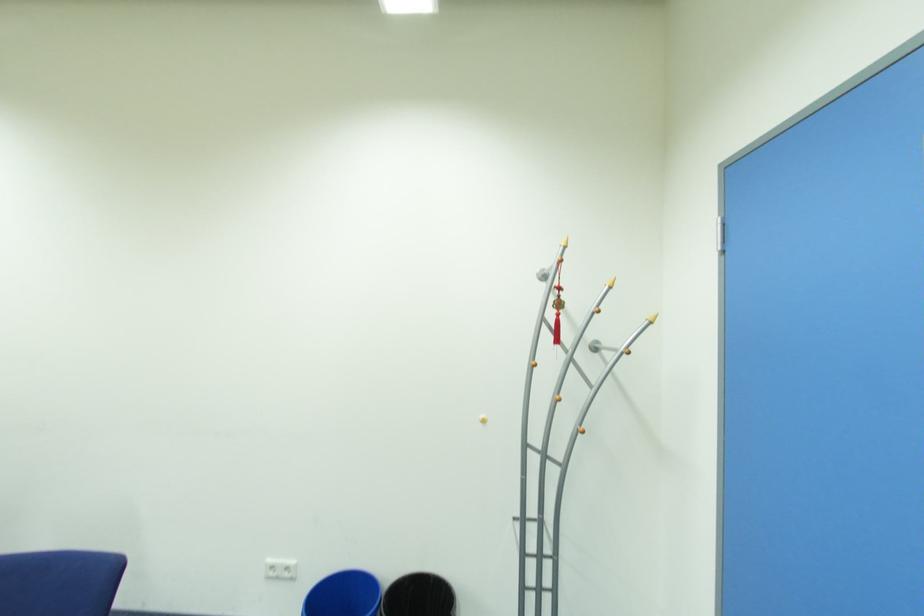
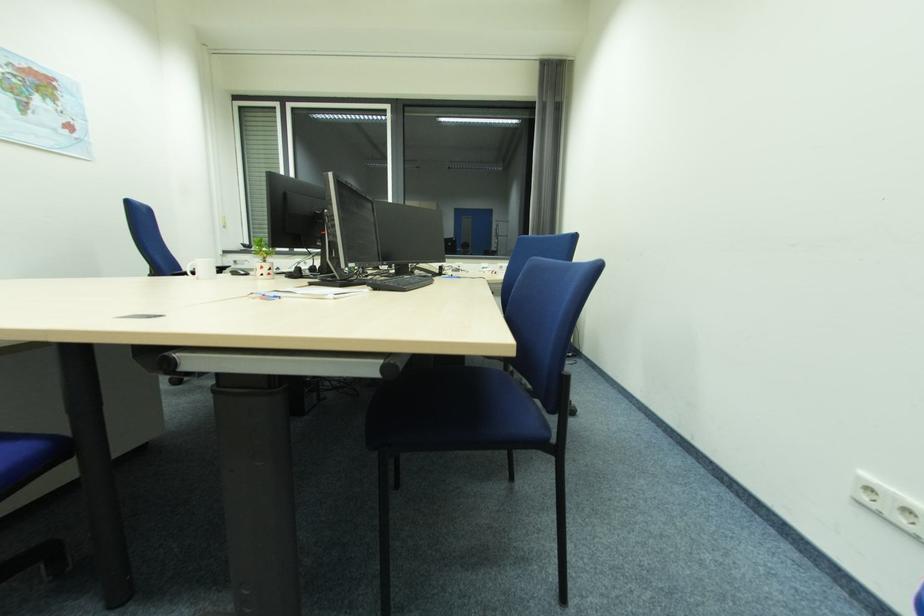
Question: The camera is either moving clockwise (left) or counter-clockwise (right) around the object. The first image is from the beginning of the video and the second image is from the end. Is the camera moving left or right when shooting the video?

Choices:
 (A) Left
 (B) Right

Answer: (B)